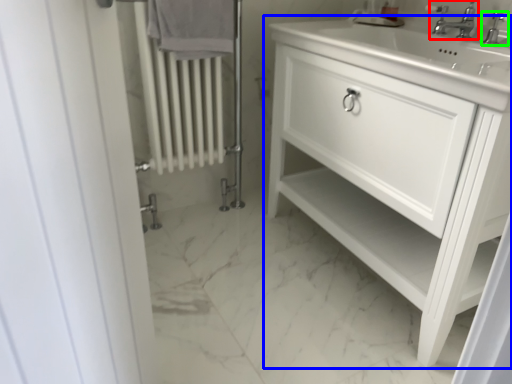
Question: Considering the real-world distances, which object is closest to tap (highlighted by a red box)? bathroom cabinet (highlighted by a blue box) or tap (highlighted by a green box).

Choices:
 (A) bathroom cabinet
 (B) tap

Answer: (B)